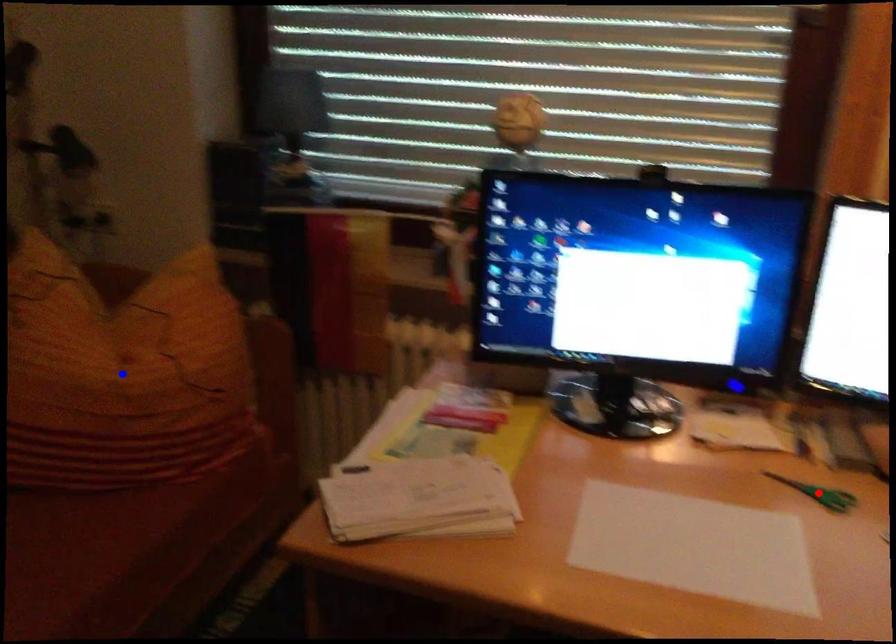
Question: Which of the two points in the image is closer to the camera?

Choices:
 (A) Blue point is closer.
 (B) Red point is closer.

Answer: (B)